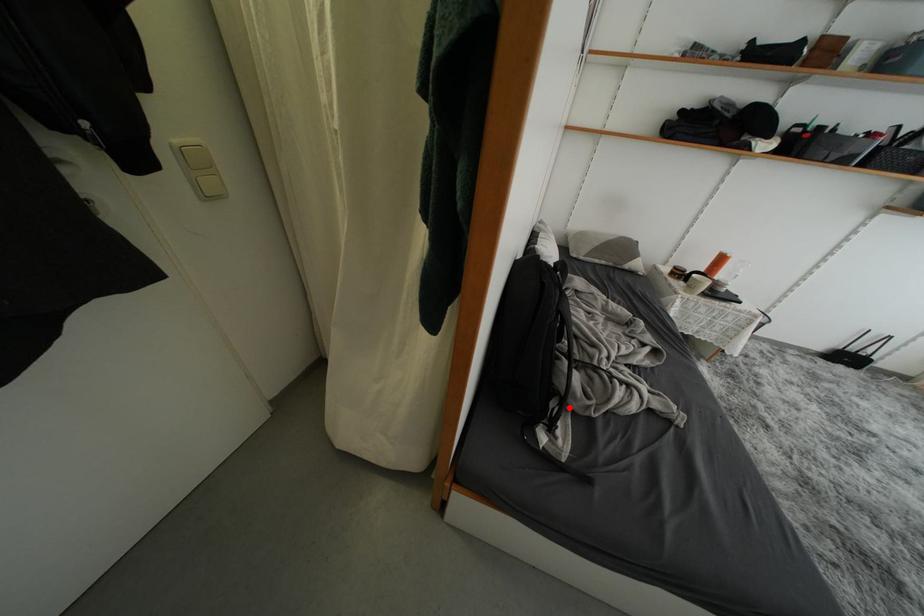
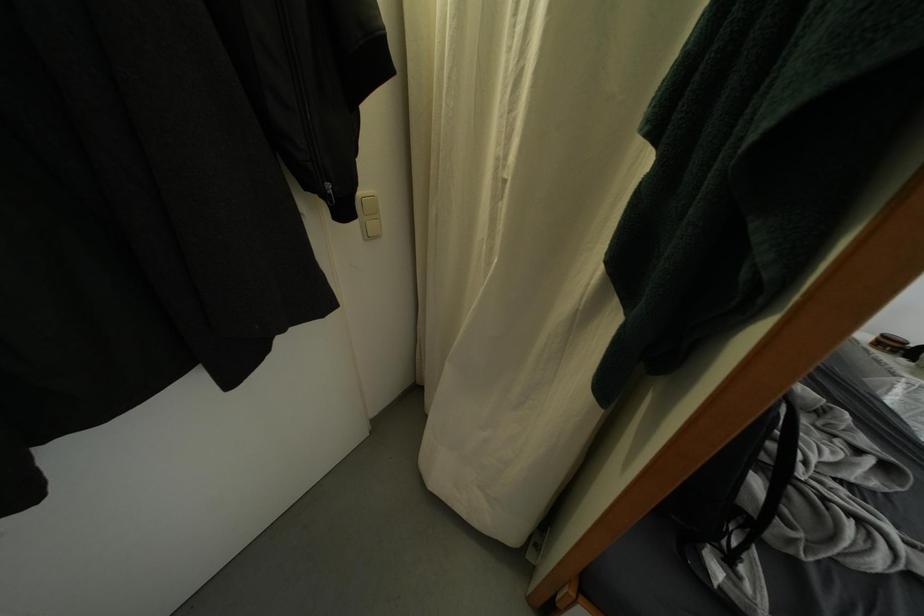
Locate, in the second image, the point that corresponds to the highlighted location in the first image.

(759, 531)